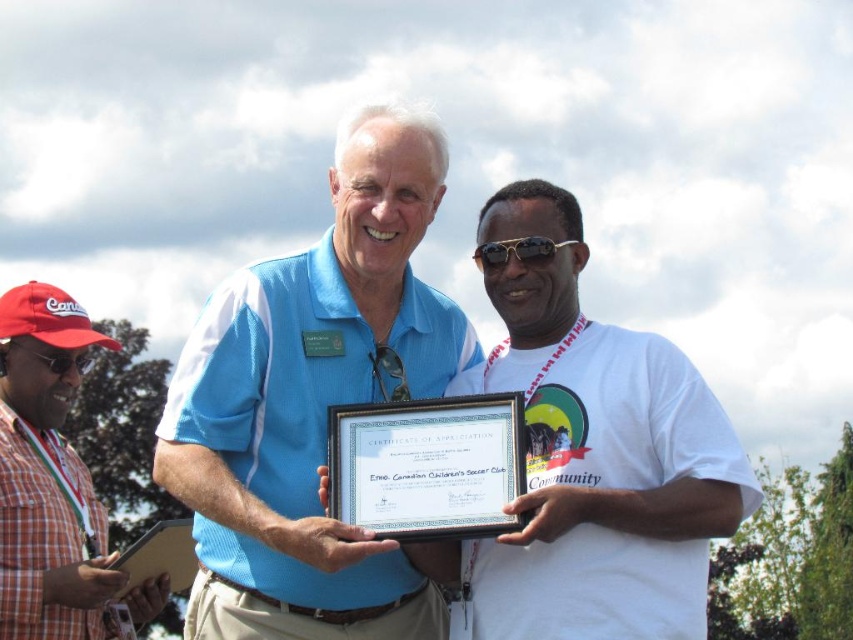
Does white paper certificate at center appear on the left side of matte black goggles at left?

No, white paper certificate at center is not to the left of matte black goggles at left.

Is point (474, 472) closer to viewer compared to point (45, 355)?

Yes, it is in front of point (45, 355).

Where is `white paper certificate at center`? The height and width of the screenshot is (640, 853). white paper certificate at center is located at coordinates (427, 467).

Is white matte t-shirt at center further to the viewer compared to matte black goggles at left?

No.

Who is positioned more to the right, white matte t-shirt at center or matte black goggles at left?

From the viewer's perspective, white matte t-shirt at center appears more on the right side.

Which is behind, point (474, 540) or point (0, 356)?

Positioned behind is point (0, 356).

The image size is (853, 640). In order to click on white matte t-shirt at center in this screenshot , I will do `click(595, 458)`.

Which of these two, red plaid shirt at left or gold metallic sunglasses at center, stands shorter?

Standing shorter between the two is gold metallic sunglasses at center.

This screenshot has height=640, width=853. Describe the element at coordinates (48, 476) in the screenshot. I see `red plaid shirt at left` at that location.

What do you see at coordinates (48, 476) in the screenshot? I see `red plaid shirt at left` at bounding box center [48, 476].

Locate an element on the screen. The height and width of the screenshot is (640, 853). red plaid shirt at left is located at coordinates (48, 476).